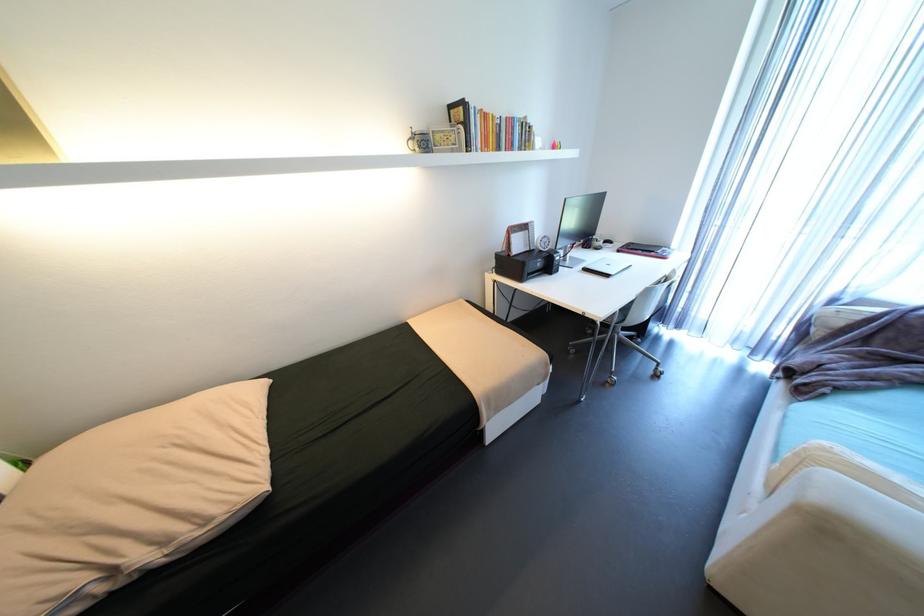
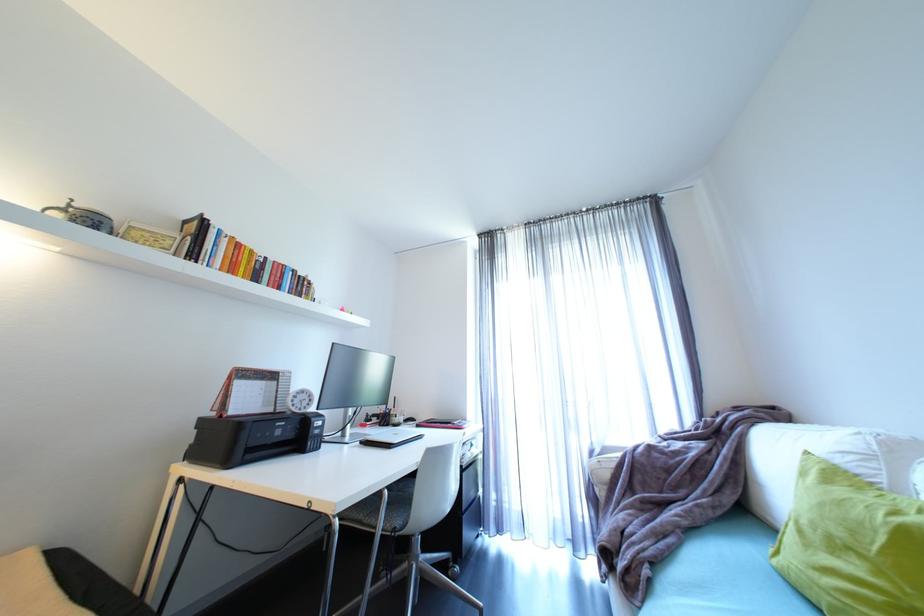
First-person continuous shooting, in which direction is the camera rotating?

The camera rotated toward right-up.